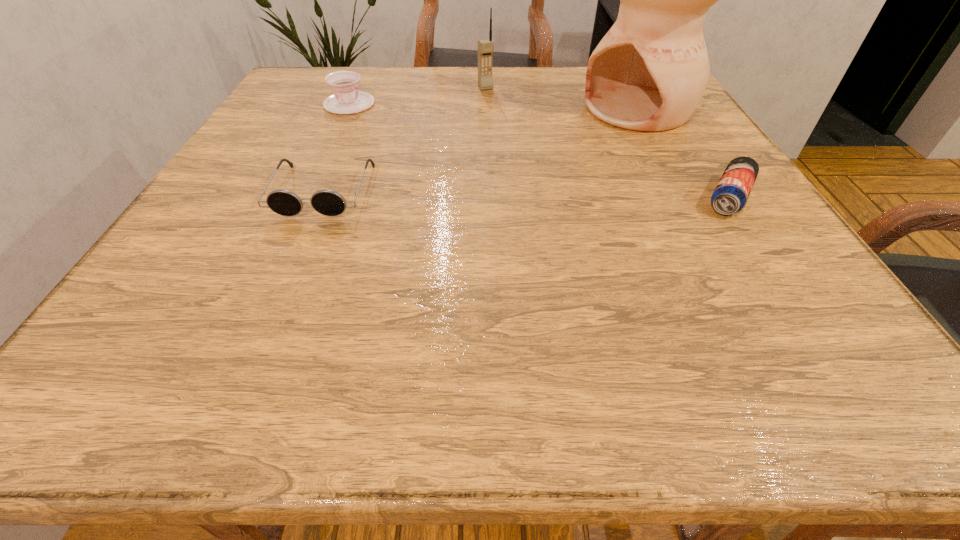
The height and width of the screenshot is (540, 960). Find the location of `free space on the desktop that is between the sunglasses and the beer can and is positioned at the open side of the pottery`. free space on the desktop that is between the sunglasses and the beer can and is positioned at the open side of the pottery is located at coordinates (468, 193).

I want to click on free space on the desktop that is between the sunglasses and the beer can and is positioned on the handle side of the teacup, so click(527, 194).

Identify the location of vacant space on the desktop that is between the sunglasses and the beer can and is positioned on the front of the fourth shortest object, where the keypad is located. The width and height of the screenshot is (960, 540). (551, 194).